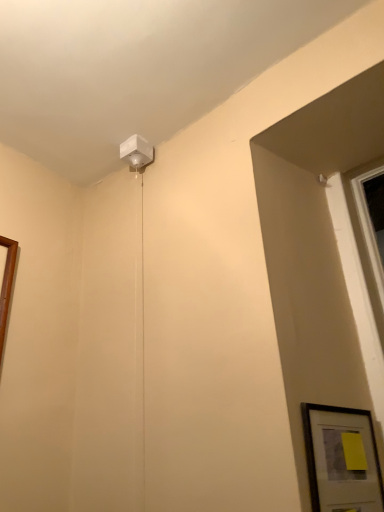
What are the coordinates of `matte black picture frame at lower right` in the screenshot? It's located at (342, 458).

What do you see at coordinates (342, 458) in the screenshot?
I see `matte black picture frame at lower right` at bounding box center [342, 458].

What are the coordinates of `matte black picture frame at lower right` in the screenshot? It's located at (342, 458).